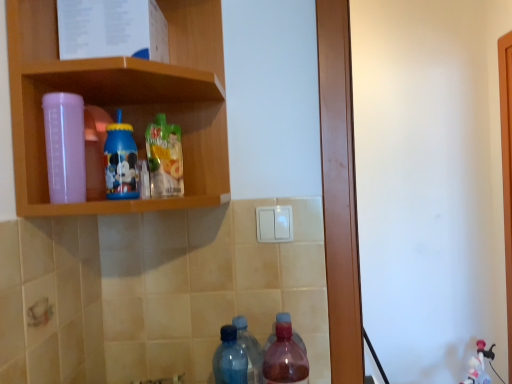
Question: Is there a large distance between transparent plastic bottle at upper left, which appears as the fifth bottle when viewed from the right, and blue translucent bottle at lower center, the 4th bottle viewed from the left?

Choices:
 (A) no
 (B) yes

Answer: (A)

Question: Can you confirm if transparent plastic bottle at upper left, which appears as the fifth bottle when viewed from the right, is taller than blue translucent bottle at lower center, acting as the second bottle starting from the right?

Choices:
 (A) yes
 (B) no

Answer: (B)

Question: From a real-world perspective, is transparent plastic bottle at upper left, marked as the 1th bottle in a left-to-right arrangement, located beneath blue translucent bottle at lower center, the 4th bottle viewed from the left?

Choices:
 (A) no
 (B) yes

Answer: (A)

Question: Is transparent plastic bottle at upper left, which appears as the fifth bottle when viewed from the right, in contact with blue translucent bottle at lower center, the 4th bottle viewed from the left?

Choices:
 (A) no
 (B) yes

Answer: (A)

Question: Is transparent plastic bottle at upper left, which appears as the fifth bottle when viewed from the right, outside of blue translucent bottle at lower center, the 4th bottle viewed from the left?

Choices:
 (A) no
 (B) yes

Answer: (B)

Question: Looking at the image, does transparent plastic bottle at upper left, which appears as the fifth bottle when viewed from the right, seem bigger or smaller compared to translucent plastic juice at center, the 3th bottle viewed from the right?

Choices:
 (A) small
 (B) big

Answer: (B)

Question: Relative to translucent plastic juice at center, the 3th bottle viewed from the right, is transparent plastic bottle at upper left, which appears as the fifth bottle when viewed from the right, in front or behind?

Choices:
 (A) front
 (B) behind

Answer: (A)

Question: Is transparent plastic bottle at upper left, which appears as the fifth bottle when viewed from the right, wider or thinner than translucent plastic juice at center, marked as the 3th bottle in a left-to-right arrangement?

Choices:
 (A) wide
 (B) thin

Answer: (B)

Question: Is transparent plastic bottle at upper left, marked as the 1th bottle in a left-to-right arrangement, taller or shorter than translucent plastic juice at center, marked as the 3th bottle in a left-to-right arrangement?

Choices:
 (A) tall
 (B) short

Answer: (A)

Question: Does point (53, 178) appear closer or farther from the camera than point (126, 165)?

Choices:
 (A) closer
 (B) farther

Answer: (A)

Question: Is transparent plastic bottle at upper left, which appears as the fifth bottle when viewed from the right, wider or thinner than blue plastic cup at upper center, positioned as the second bottle in left-to-right order?

Choices:
 (A) wide
 (B) thin

Answer: (B)

Question: From the image's perspective, is transparent plastic bottle at upper left, marked as the 1th bottle in a left-to-right arrangement, above or below blue plastic cup at upper center, which ranks as the 4th bottle in right-to-left order?

Choices:
 (A) above
 (B) below

Answer: (B)

Question: Considering their positions, is transparent plastic bottle at upper left, marked as the 1th bottle in a left-to-right arrangement, located in front of or behind blue plastic cup at upper center, positioned as the second bottle in left-to-right order?

Choices:
 (A) behind
 (B) front

Answer: (B)

Question: Is translucent pink bottle at lower center, acting as the 5th bottle starting from the left, in front of or behind transparent plastic bottle at upper left, which appears as the fifth bottle when viewed from the right, in the image?

Choices:
 (A) behind
 (B) front

Answer: (A)

Question: Considering the positions of translucent pink bottle at lower center, acting as the 5th bottle starting from the left, and transparent plastic bottle at upper left, which appears as the fifth bottle when viewed from the right, in the image, is translucent pink bottle at lower center, acting as the 5th bottle starting from the left, wider or thinner than transparent plastic bottle at upper left, which appears as the fifth bottle when viewed from the right,?

Choices:
 (A) thin
 (B) wide

Answer: (B)